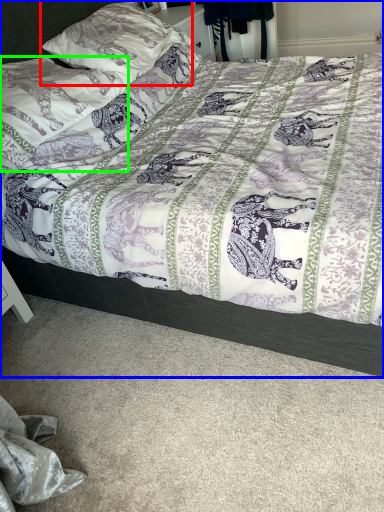
Question: Based on their relative distances, which object is nearer to pillow (highlighted by a red box)? Choose from bed (highlighted by a blue box) and pillow (highlighted by a green box).

Choices:
 (A) bed
 (B) pillow

Answer: (B)